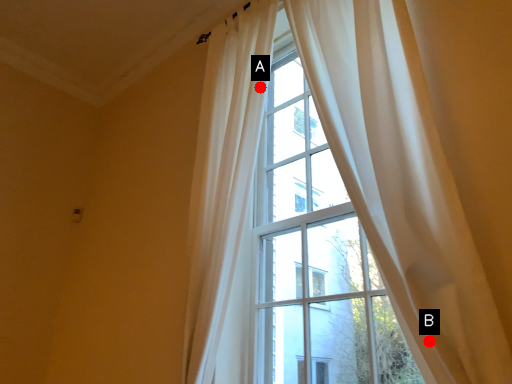
Question: Two points are circled on the image, labeled by A and B beside each circle. Which point is closer to the camera?

Choices:
 (A) A is closer
 (B) B is closer

Answer: (B)